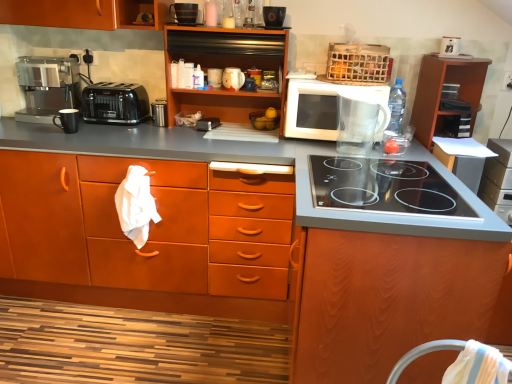
Question: Is metallic silver toaster at center, which is counted as the 2th appliance, starting from the left, surrounding black plastic toaster at left?

Choices:
 (A) yes
 (B) no

Answer: (B)

Question: Can you confirm if metallic silver toaster at center, the fourth appliance in the right-to-left sequence, is shorter than black plastic toaster at left?

Choices:
 (A) no
 (B) yes

Answer: (B)

Question: Is metallic silver toaster at center, which is counted as the 2th appliance, starting from the left, outside of black plastic toaster at left?

Choices:
 (A) yes
 (B) no

Answer: (A)

Question: Considering the relative sizes of metallic silver toaster at center, the fourth appliance in the right-to-left sequence, and black plastic toaster at left in the image provided, is metallic silver toaster at center, the fourth appliance in the right-to-left sequence, smaller than black plastic toaster at left?

Choices:
 (A) yes
 (B) no

Answer: (A)

Question: Can you confirm if metallic silver toaster at center, the fourth appliance in the right-to-left sequence, is wider than black plastic toaster at left?

Choices:
 (A) yes
 (B) no

Answer: (B)

Question: From a real-world perspective, is wooden cabinet at center, the 1th cabinetry when ordered from left to right, above or below wooden cabinet at center, which is the fourth cabinetry in left-to-right order?

Choices:
 (A) above
 (B) below

Answer: (B)

Question: Is wooden cabinet at center, the 5th cabinetry when ordered from right to left, wider or thinner than wooden cabinet at center, which is the fourth cabinetry in left-to-right order?

Choices:
 (A) wide
 (B) thin

Answer: (B)

Question: From the image's perspective, is wooden cabinet at center, the 5th cabinetry when ordered from right to left, above or below wooden cabinet at center, which is the fourth cabinetry in left-to-right order?

Choices:
 (A) below
 (B) above

Answer: (B)

Question: Considering the positions of wooden cabinet at center, the 5th cabinetry when ordered from right to left, and wooden cabinet at center, which ranks as the 2th cabinetry in right-to-left order, in the image, is wooden cabinet at center, the 5th cabinetry when ordered from right to left, taller or shorter than wooden cabinet at center, which ranks as the 2th cabinetry in right-to-left order,?

Choices:
 (A) short
 (B) tall

Answer: (B)

Question: From a real-world perspective, is white glossy microwave at upper center above or below black plastic toaster at left?

Choices:
 (A) above
 (B) below

Answer: (A)

Question: Considering the positions of white glossy microwave at upper center and black plastic toaster at left in the image, is white glossy microwave at upper center bigger or smaller than black plastic toaster at left?

Choices:
 (A) small
 (B) big

Answer: (B)

Question: Is white glossy microwave at upper center spatially inside black plastic toaster at left, or outside of it?

Choices:
 (A) inside
 (B) outside

Answer: (B)

Question: In terms of width, does white glossy microwave at upper center look wider or thinner when compared to black plastic toaster at left?

Choices:
 (A) thin
 (B) wide

Answer: (B)

Question: Is matte wood cabinets at center, the 2th cabinetry from the left, spatially inside white fabric chair at lower right, or outside of it?

Choices:
 (A) outside
 (B) inside

Answer: (A)

Question: In terms of height, does matte wood cabinets at center, which is counted as the fourth cabinetry, starting from the right, look taller or shorter compared to white fabric chair at lower right?

Choices:
 (A) tall
 (B) short

Answer: (A)